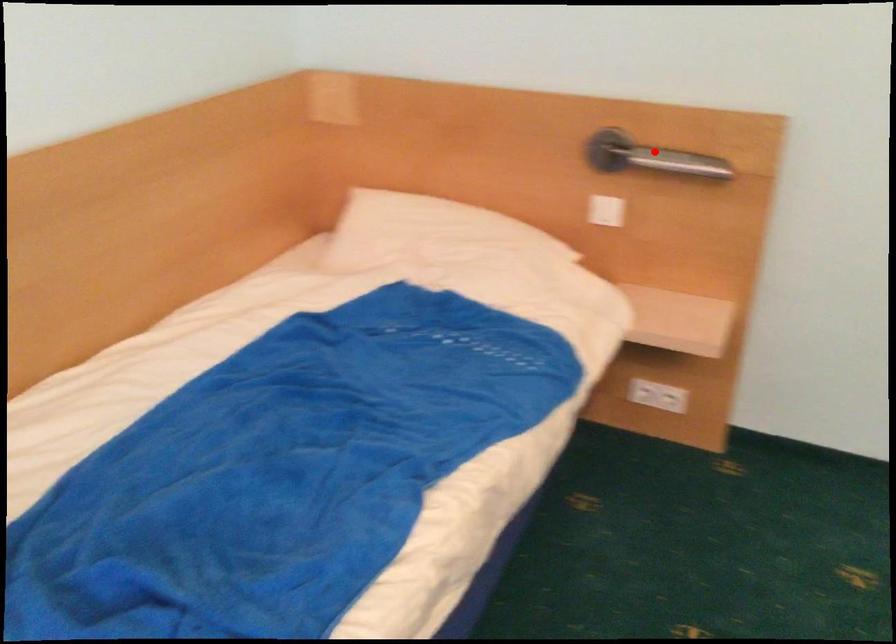
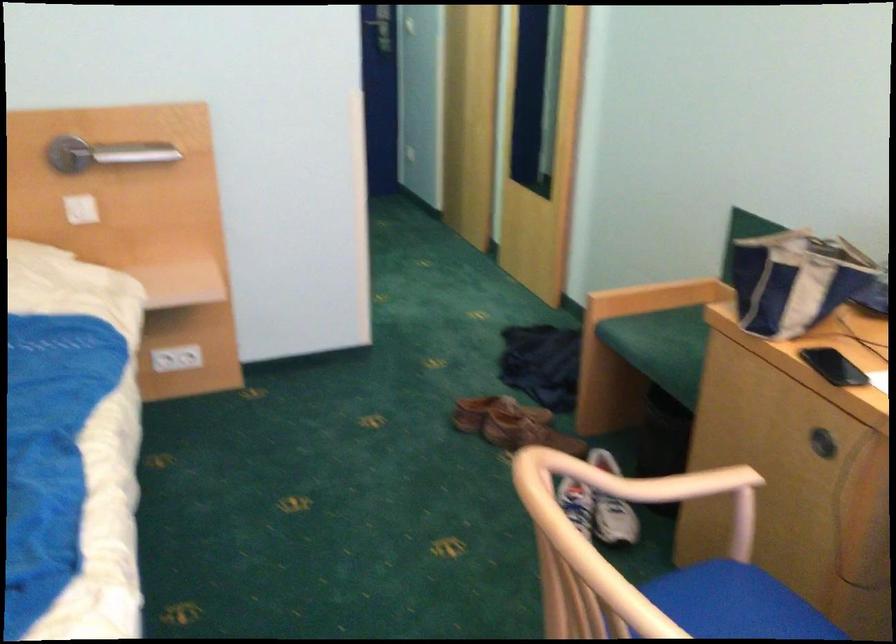
Question: A red point is marked in image1. In image2, is the corresponding 3D point closer to the camera or farther? Reply with the corresponding letter.

Choices:
 (A) The corresponding 3D point is closer.
 (B) The corresponding 3D point is farther.

Answer: (B)